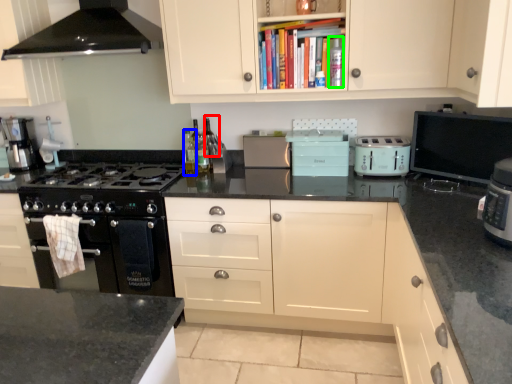
Question: Which object is the farthest from wine bottle (highlighted by a red box)? Choose among these: bottle (highlighted by a blue box) or bottle (highlighted by a green box).

Choices:
 (A) bottle
 (B) bottle

Answer: (B)